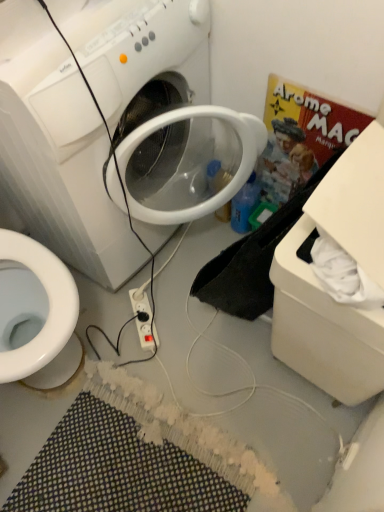
I want to click on unoccupied space behind multicolored woven bath mat at lower center, so click(158, 334).